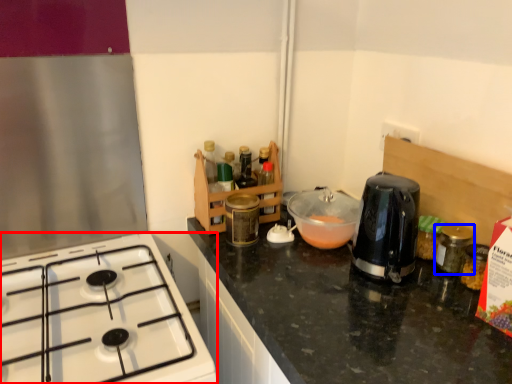
Question: Which of the following is the closest to the observer, gas stove (highlighted by a red box) or bottle (highlighted by a blue box)?

Choices:
 (A) gas stove
 (B) bottle

Answer: (A)